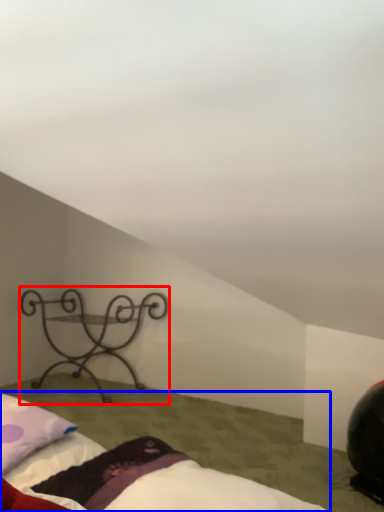
Question: Which point is further to the camera, furniture (highlighted by a red box) or bed (highlighted by a blue box)?

Choices:
 (A) furniture
 (B) bed

Answer: (A)